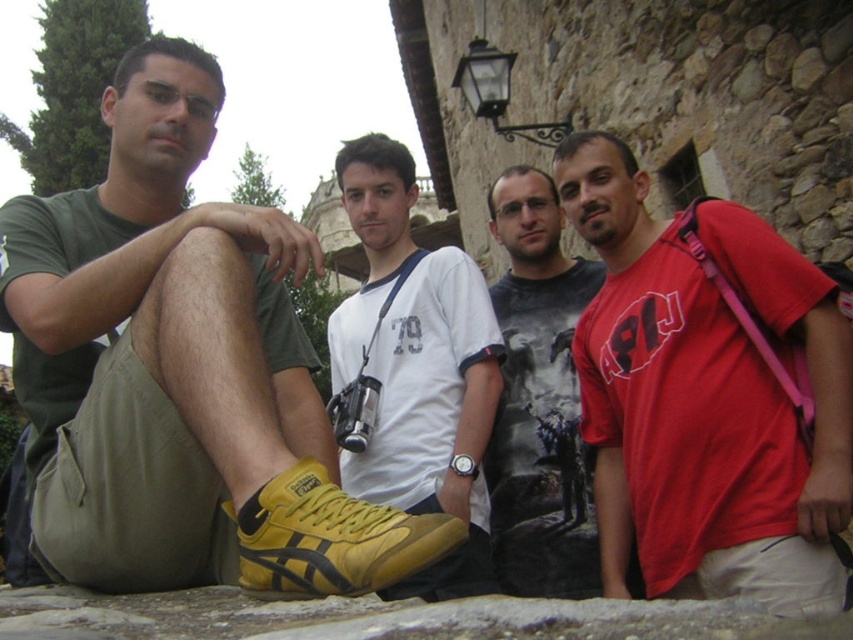
You are a photographer adjusting your camera settings to capture the group photo. You notice the red matte shirt at center and the yellow leather shoe at center. Which object should you focus on first if you want to ensure both are in sharp focus, considering their positions?

The red matte shirt at center is above the yellow leather shoe at center, so focusing on the red matte shirt at center first will help ensure both are in sharp focus since it is closer to the camera.